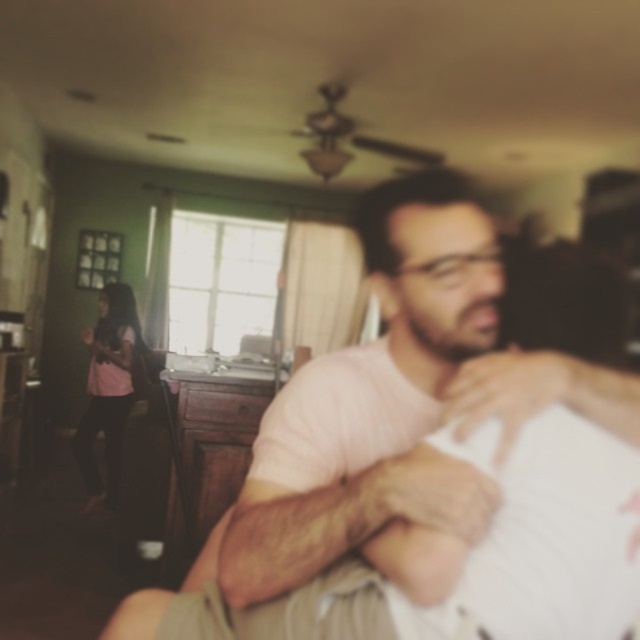
Can you confirm if pink cotton shirt at center is taller than pink fabric shirt at left?

No.

Is point (458, 257) farther from viewer compared to point (108, 316)?

No, (458, 257) is closer to viewer.

At what (x,y) coordinates should I click in order to perform the action: click on pink cotton shirt at center. Please return your answer as a coordinate pair (x, y). Looking at the image, I should click on (374, 416).